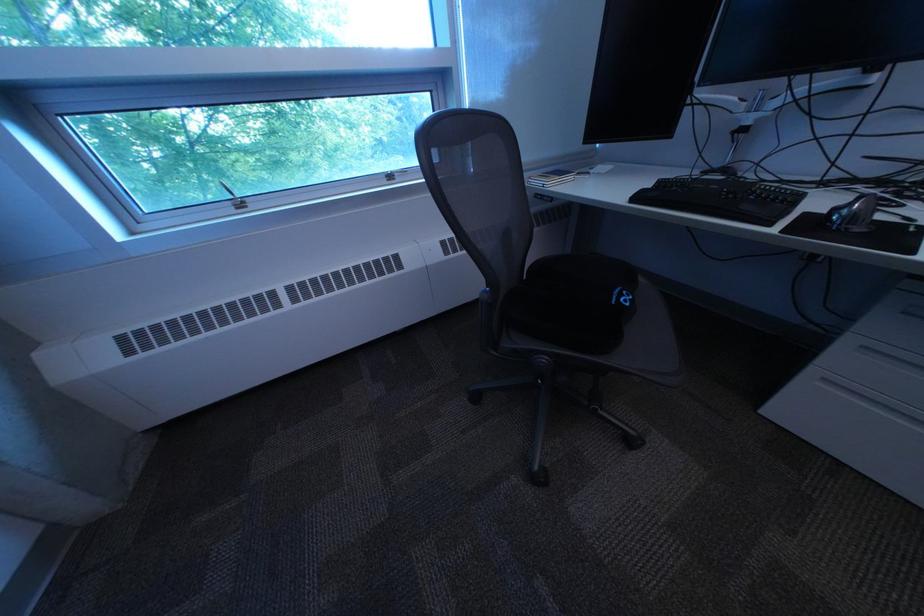
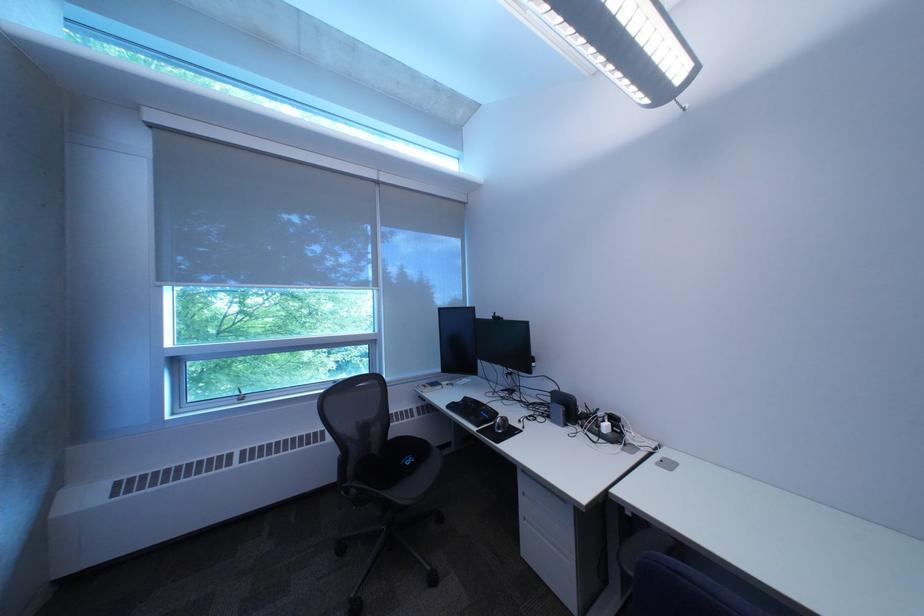
The point at [444,97] is marked in the first image. Where is the corresponding point in the second image?

(383, 347)